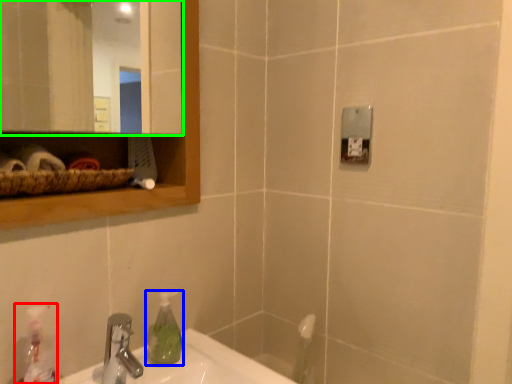
Question: Estimate the real-world distances between objects in this image. Which object is farther from cleaning product (highlighted by a red box), soap dispenser (highlighted by a blue box) or mirror (highlighted by a green box)?

Choices:
 (A) soap dispenser
 (B) mirror

Answer: (B)